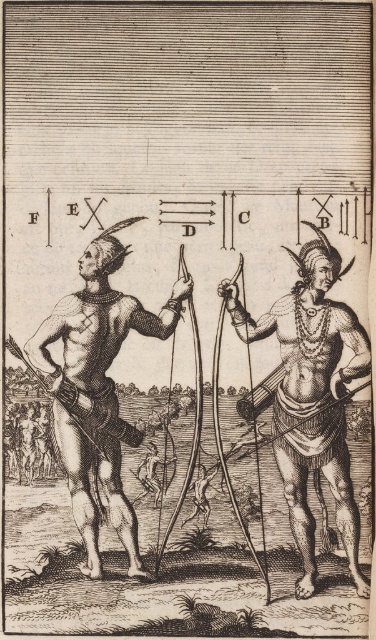
Question: Among these points, which one is farthest from the camera?

Choices:
 (A) (86, 282)
 (B) (347, 550)

Answer: (A)

Question: Among these objects, which one is nearest to the camera?

Choices:
 (A) black textured skin at left
 (B) smooth wood bow at center

Answer: (A)

Question: Does smooth wood bow at center appear over black textured skin at left?

Choices:
 (A) no
 (B) yes

Answer: (A)

Question: Observing the image, what is the correct spatial positioning of smooth wood bow at center in reference to black textured skin at left?

Choices:
 (A) right
 (B) left

Answer: (A)

Question: Which object is closer to the camera taking this photo?

Choices:
 (A) smooth wood bow at center
 (B) black textured skin at left

Answer: (B)

Question: Does smooth wood bow at center have a greater width compared to black textured skin at left?

Choices:
 (A) no
 (B) yes

Answer: (A)